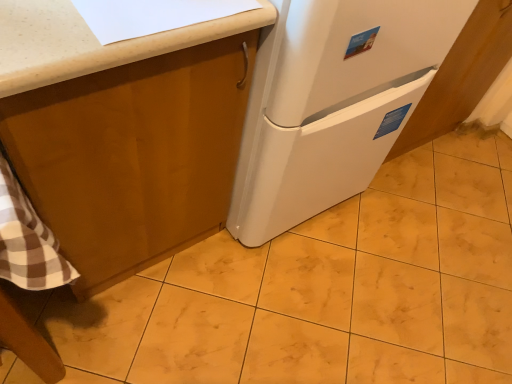
Where is `free location above yellow marble tile at center (from a real-world perspective)`? This screenshot has width=512, height=384. free location above yellow marble tile at center (from a real-world perspective) is located at coordinates (x=359, y=276).